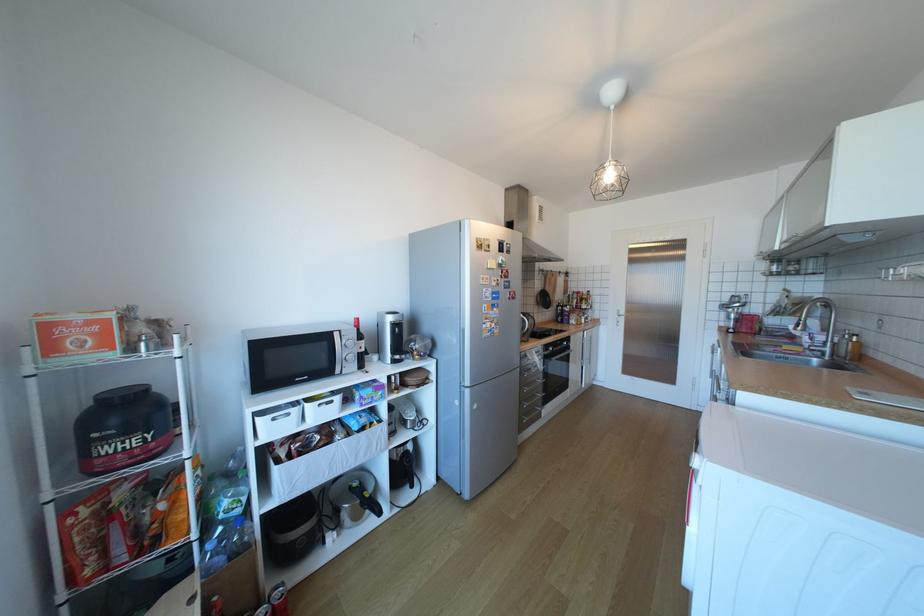
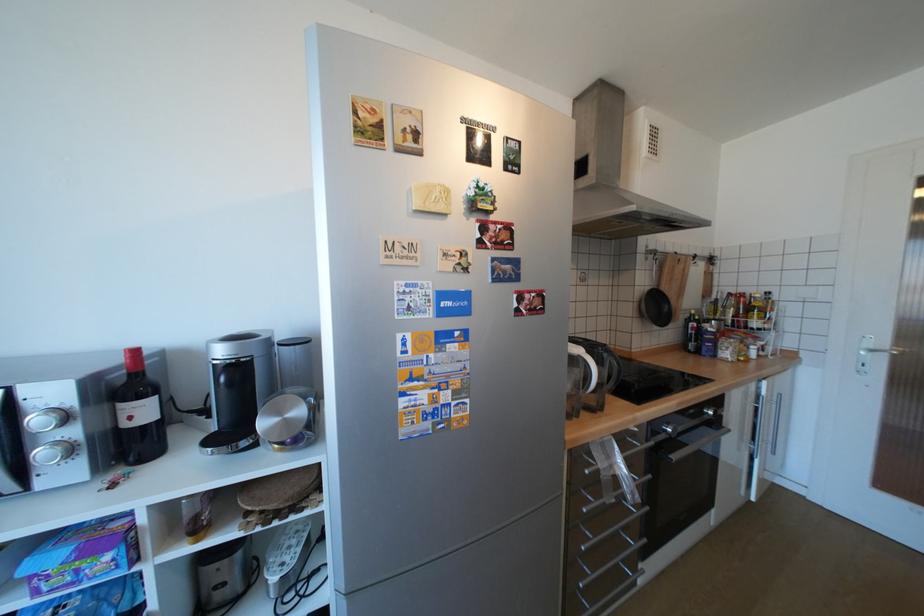
Where in the second image is the point corresponding to (628,315) from the first image?

(881, 351)